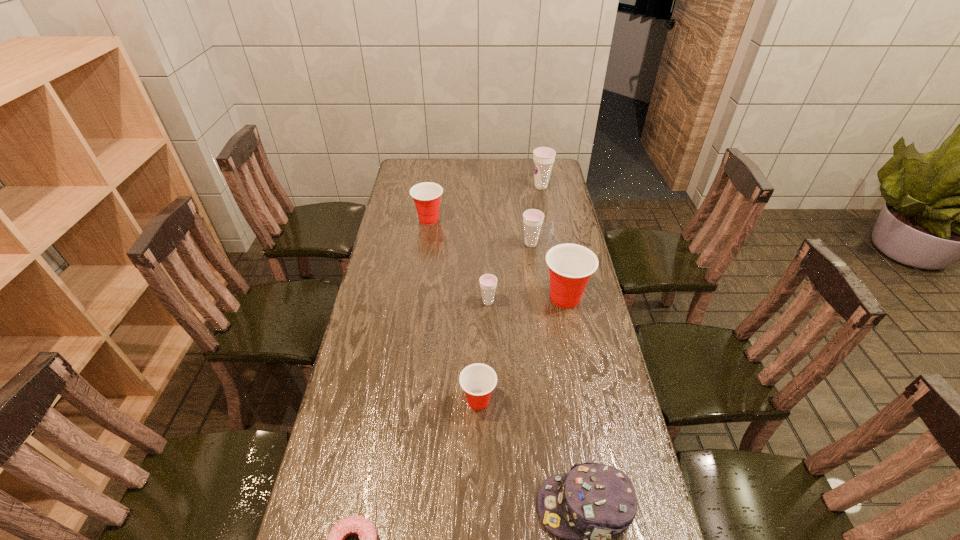
Identify the location of the farthest cup. The height and width of the screenshot is (540, 960). (543, 157).

You are a GUI agent. You are given a task and a screenshot of the screen. Output one action in this format:
    pyautogui.click(x=<x>, y=<y>)
    Task: Click on the farthest purple cup
    This screenshot has height=540, width=960.
    Given the screenshot: What is the action you would take?
    pyautogui.click(x=543, y=157)

The width and height of the screenshot is (960, 540). I want to click on the biggest red cup, so click(x=570, y=265).

The height and width of the screenshot is (540, 960). What are the coordinates of `the second nearest red cup` in the screenshot? It's located at (570, 265).

This screenshot has width=960, height=540. In order to click on the second smallest red cup in this screenshot , I will do `click(426, 195)`.

Identify the location of the farthest red cup. [x=426, y=195].

Locate an element on the screen. This screenshot has height=540, width=960. the second smallest purple cup is located at coordinates (532, 218).

Image resolution: width=960 pixels, height=540 pixels. I want to click on the third farthest cup, so pos(532,218).

This screenshot has width=960, height=540. What are the coordinates of `the nearest purple cup` in the screenshot? It's located at (488, 282).

Identify the location of the smallest purple cup. (488, 282).